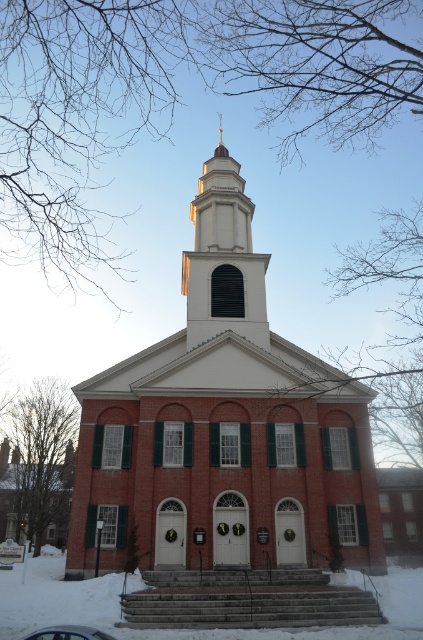
Based on the photo, you are standing in front of the brick church at center and the white smooth steeple at center. Which object is located higher in the image?

The white smooth steeple at center is higher than the brick church at center because it is positioned above it.

What are the coordinates of the white smooth steeple at center?

The white smooth steeple at center is located at coordinates point (224, 259).